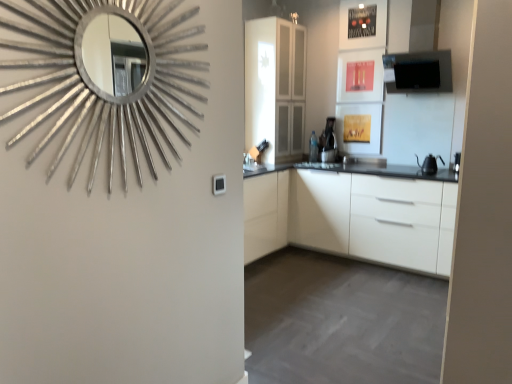
Question: Does black matte exhaust hood at upper right have a lesser height compared to transparent glass cabinet at center?

Choices:
 (A) no
 (B) yes

Answer: (B)

Question: Considering the relative sizes of black matte exhaust hood at upper right and transparent glass cabinet at center in the image provided, is black matte exhaust hood at upper right smaller than transparent glass cabinet at center?

Choices:
 (A) no
 (B) yes

Answer: (B)

Question: Is black matte exhaust hood at upper right aimed at transparent glass cabinet at center?

Choices:
 (A) no
 (B) yes

Answer: (A)

Question: Does black matte exhaust hood at upper right come behind transparent glass cabinet at center?

Choices:
 (A) no
 (B) yes

Answer: (A)

Question: Is black matte exhaust hood at upper right wider than transparent glass cabinet at center?

Choices:
 (A) yes
 (B) no

Answer: (B)

Question: From a real-world perspective, is black matte exhaust hood at upper right located higher than transparent glass cabinet at center?

Choices:
 (A) no
 (B) yes

Answer: (B)

Question: Considering the relative sizes of white glossy sink at center and black matte kettle at right in the image provided, is white glossy sink at center taller than black matte kettle at right?

Choices:
 (A) no
 (B) yes

Answer: (B)

Question: Is white glossy sink at center positioned with its back to black matte kettle at right?

Choices:
 (A) yes
 (B) no

Answer: (B)

Question: Does white glossy sink at center appear on the right side of black matte kettle at right?

Choices:
 (A) yes
 (B) no

Answer: (B)

Question: Does white glossy sink at center have a lesser height compared to black matte kettle at right?

Choices:
 (A) yes
 (B) no

Answer: (B)

Question: Would you say white glossy sink at center is outside black matte kettle at right?

Choices:
 (A) yes
 (B) no

Answer: (A)

Question: Does white glossy sink at center turn towards black matte kettle at right?

Choices:
 (A) yes
 (B) no

Answer: (B)

Question: Is white glossy sink at center smaller than silver metallic mirror at upper left?

Choices:
 (A) no
 (B) yes

Answer: (B)